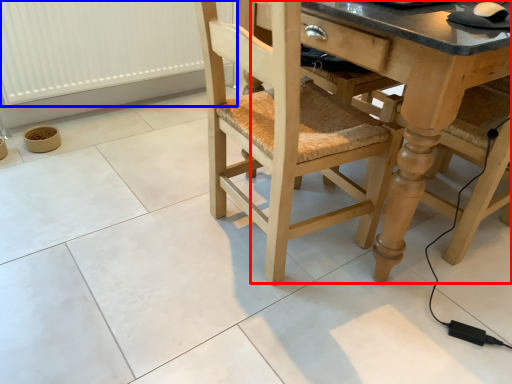
Question: Among these objects, which one is farthest to the camera, counter top (highlighted by a red box) or radiator (highlighted by a blue box)?

Choices:
 (A) counter top
 (B) radiator

Answer: (B)